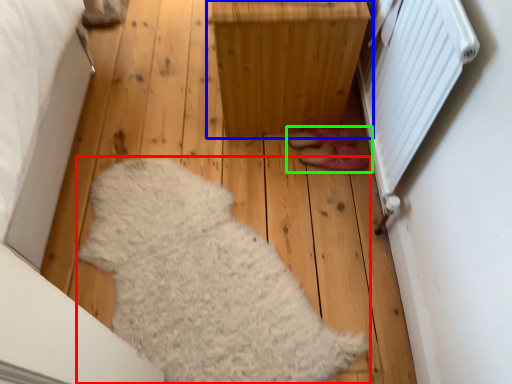
Question: Estimate the real-world distances between objects in this image. Which object is closer to blanket (highlighted by a red box), furniture (highlighted by a blue box) or footwear (highlighted by a green box)?

Choices:
 (A) furniture
 (B) footwear

Answer: (A)